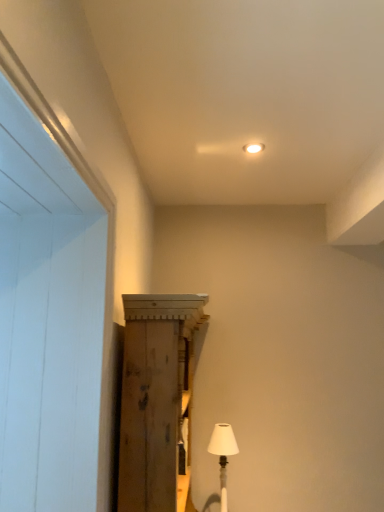
Question: Is wooden cabinet at center to the right of white fabric lampshade at lower right from the viewer's perspective?

Choices:
 (A) no
 (B) yes

Answer: (A)

Question: Is white fabric lampshade at lower right completely or partially inside wooden cabinet at center?

Choices:
 (A) yes
 (B) no

Answer: (A)

Question: Is wooden cabinet at center bigger than white fabric lampshade at lower right?

Choices:
 (A) yes
 (B) no

Answer: (A)

Question: Considering the relative sizes of wooden cabinet at center and white fabric lampshade at lower right in the image provided, is wooden cabinet at center smaller than white fabric lampshade at lower right?

Choices:
 (A) yes
 (B) no

Answer: (B)

Question: Is the position of wooden cabinet at center more distant than that of white fabric lampshade at lower right?

Choices:
 (A) no
 (B) yes

Answer: (A)

Question: Is wooden cabinet at center aimed at white fabric lampshade at lower right?

Choices:
 (A) no
 (B) yes

Answer: (B)

Question: Is wooden cabinet at center at the back of white fabric lampshade at lower right?

Choices:
 (A) yes
 (B) no

Answer: (A)

Question: Would you say white fabric lampshade at lower right is a long distance from wooden cabinet at center?

Choices:
 (A) no
 (B) yes

Answer: (A)

Question: Can you confirm if white fabric lampshade at lower right is shorter than wooden cabinet at center?

Choices:
 (A) no
 (B) yes

Answer: (B)

Question: Would you say white fabric lampshade at lower right is outside wooden cabinet at center?

Choices:
 (A) no
 (B) yes

Answer: (A)

Question: Considering the relative positions of white fabric lampshade at lower right and wooden cabinet at center in the image provided, is white fabric lampshade at lower right to the right of wooden cabinet at center from the viewer's perspective?

Choices:
 (A) yes
 (B) no

Answer: (A)

Question: Considering the relative positions of white fabric lampshade at lower right and wooden cabinet at center in the image provided, is white fabric lampshade at lower right behind wooden cabinet at center?

Choices:
 (A) no
 (B) yes

Answer: (B)

Question: Considering the positions of point (127, 336) and point (220, 446), is point (127, 336) closer or farther from the camera than point (220, 446)?

Choices:
 (A) closer
 (B) farther

Answer: (A)